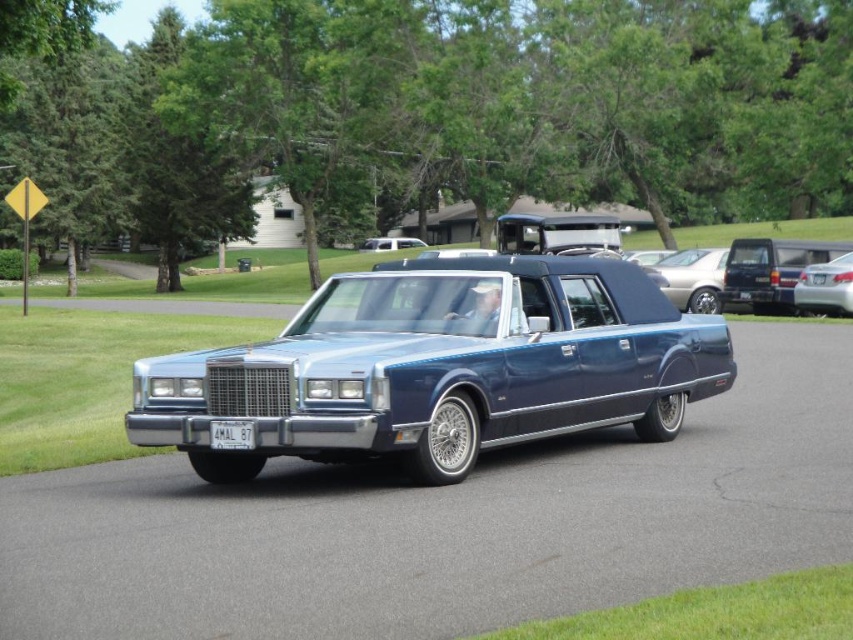
You are a parking attendant and need to fit both the metallic blue car at center and the metallic blue sedan at right into a parking spot that can only accommodate vehicles up to 5 meters in length. Which vehicle should you prioritize to ensure it fits?

The metallic blue car at center is shorter than the metallic blue sedan at right, so the metallic blue car at center should be prioritized to fit into the parking spot first.

You are a photographer at a car show and need to capture both the metallic blue car at center and the metallic blue sedan at right in a single shot. Based on their positions, which car should you focus on first to ensure both are in frame?

The metallic blue car at center is below the metallic blue sedan at right, so you should focus on the metallic blue sedan at right first to ensure both are in frame.